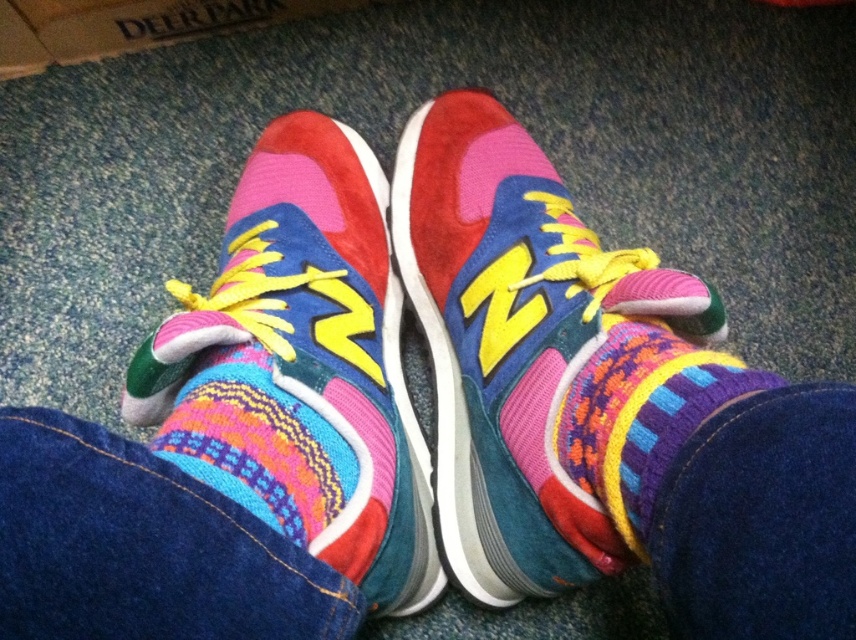
You are standing in a room and see the knitted woolen sock at center and the cardboard at upper left. Which object is nearer to you?

The knitted woolen sock at center is closer to the viewer than the cardboard at upper left.

You are a delivery person who needs to place a small package between the knitted woolen sock at center and the cardboard at upper left. Can you fit it there?

The knitted woolen sock at center is positioned on the right side of cardboard at upper left, so there is space between them to place the small package.